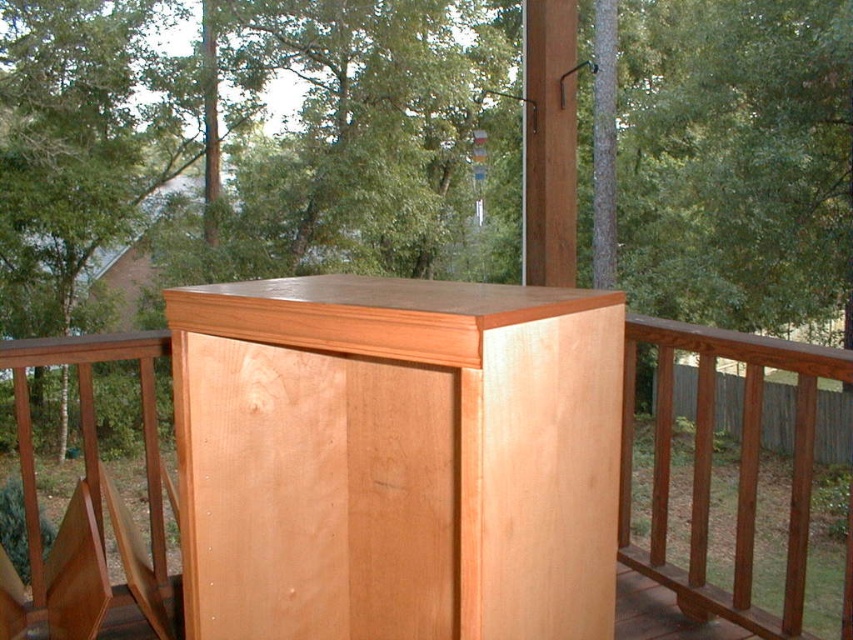
Who is more distant from viewer, (341, 8) or (144, 340)?

Positioned behind is point (341, 8).

Is natural wood tree at center above natural wood cabinet at center?

Correct, natural wood tree at center is located above natural wood cabinet at center.

Which is behind, point (676, 156) or point (666, 372)?

Positioned behind is point (676, 156).

Where is `natural wood tree at center`? The image size is (853, 640). natural wood tree at center is located at coordinates (260, 148).

In the scene shown: Who is more distant from viewer, [666,492] or [807,464]?

Positioned behind is point [666,492].

Does natural wood cabinet at center have a greater width compared to light brown wood balustrade at center?

No, natural wood cabinet at center is not wider than light brown wood balustrade at center.

Does point (738, 611) come farther from viewer compared to point (666, 433)?

No, (738, 611) is in front of (666, 433).

At what (x,y) coordinates should I click in order to perform the action: click on natural wood cabinet at center. Please return your answer as a coordinate pair (x, y). The width and height of the screenshot is (853, 640). Looking at the image, I should click on (711, 465).

Between natural wood tree at center and light brown wood balustrade at center, which one has more height?

natural wood tree at center is taller.

Does natural wood tree at center appear on the left side of light brown wood balustrade at center?

Correct, you'll find natural wood tree at center to the left of light brown wood balustrade at center.

Is point (573, 88) behind point (741, 515)?

Yes, point (573, 88) is farther from viewer.

The width and height of the screenshot is (853, 640). In order to click on natural wood tree at center in this screenshot , I will do `click(260, 148)`.